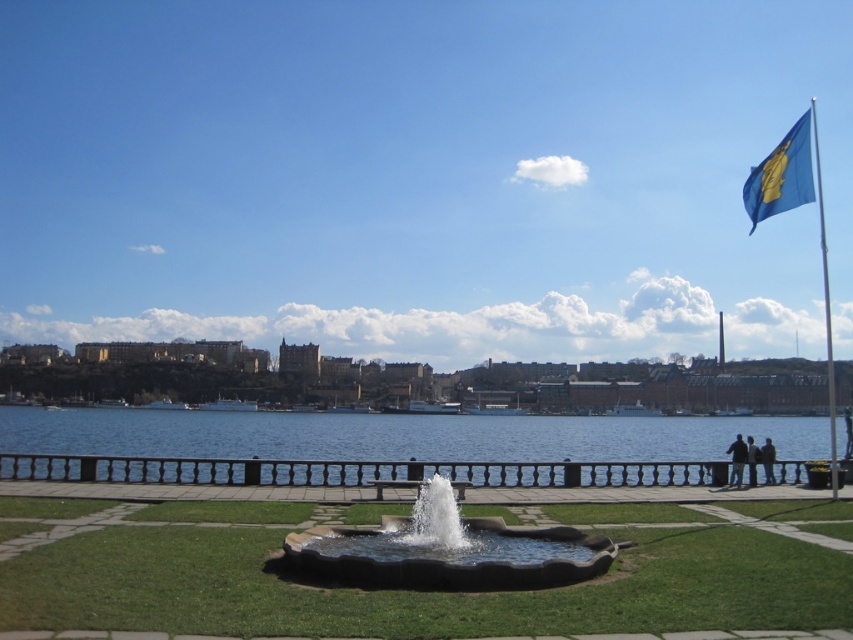
Question: Which object is farther from the camera taking this photo?

Choices:
 (A) blue fabric flag at upper right
 (B) black fabric people at lower right
 (C) green grass at center

Answer: (B)

Question: Considering the relative positions of green grass at center and blue fabric flag at upper right in the image provided, where is green grass at center located with respect to blue fabric flag at upper right?

Choices:
 (A) below
 (B) above

Answer: (A)

Question: Which of these objects is positioned closest to the blue fabric flag at upper right?

Choices:
 (A) green grass at center
 (B) clear stone fountain at center
 (C) black fabric people at lower right

Answer: (A)

Question: Is clear stone fountain at center smaller than white metallic flag pole at upper right?

Choices:
 (A) no
 (B) yes

Answer: (B)

Question: Which of the following is the farthest from the observer?

Choices:
 (A) (546, 525)
 (B) (735, 480)
 (C) (779, 211)

Answer: (B)

Question: Is green grass at center wider than blue water at center?

Choices:
 (A) no
 (B) yes

Answer: (A)